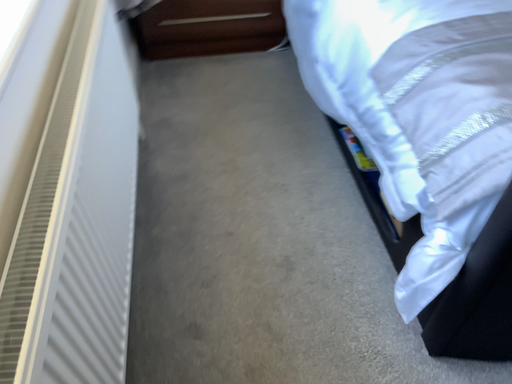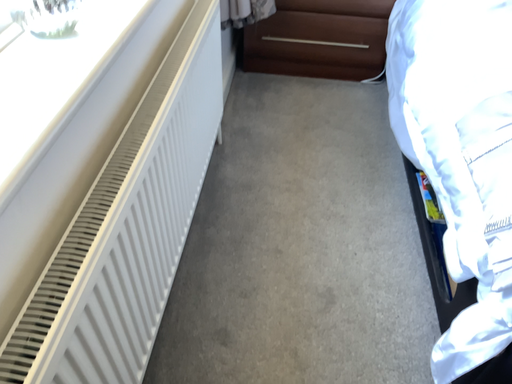
Question: Which way did the camera rotate in the video?

Choices:
 (A) rotated left
 (B) rotated right

Answer: (A)